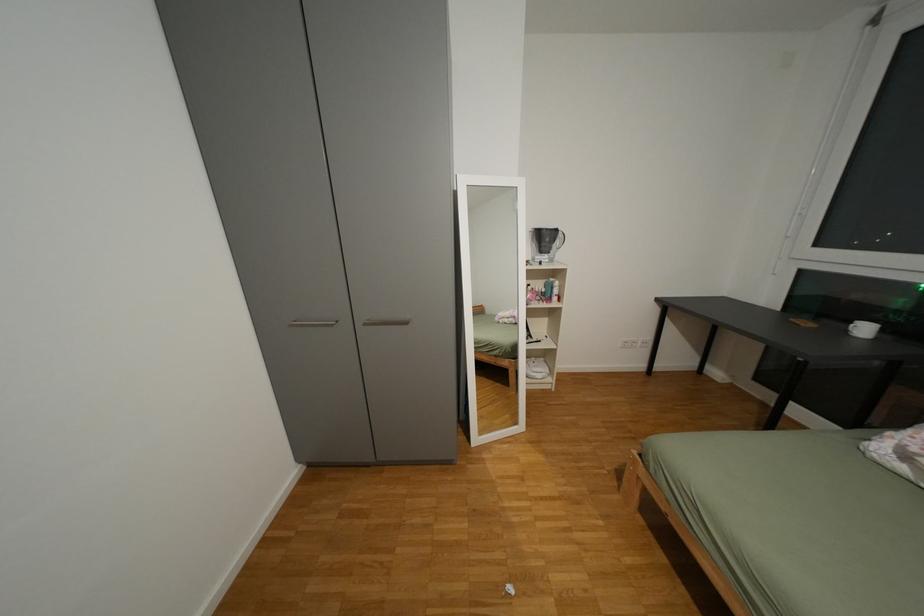
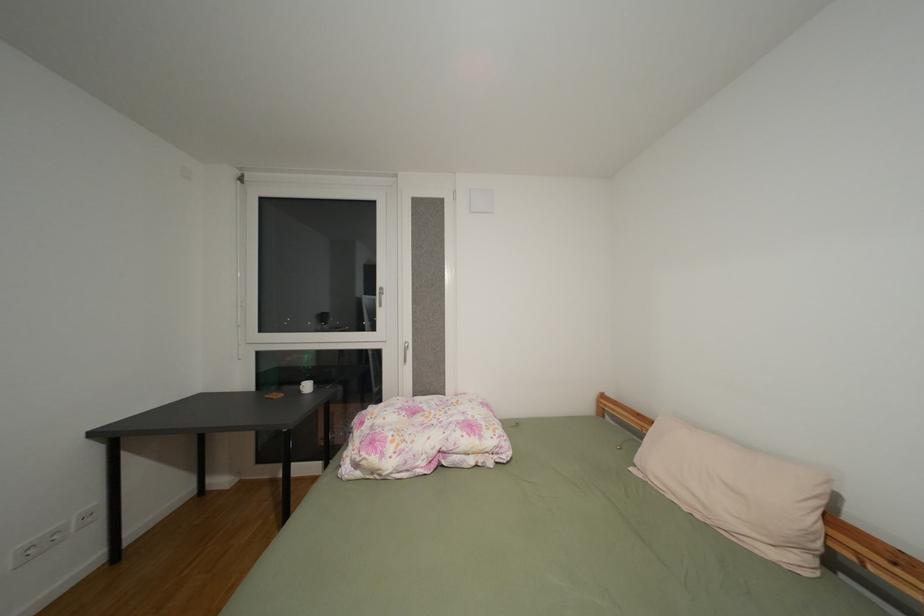
Question: The camera is either moving clockwise (left) or counter-clockwise (right) around the object. The first image is from the beginning of the video and the second image is from the end. Is the camera moving left or right when shooting the video?

Choices:
 (A) Left
 (B) Right

Answer: (A)